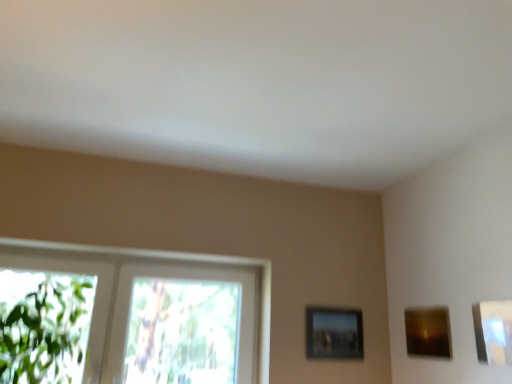
Question: Can you confirm if clear glass window at left is wider than matte brown picture frame at upper right, acting as the second picture frame starting from the left?

Choices:
 (A) yes
 (B) no

Answer: (A)

Question: Is clear glass window at left in front of matte brown picture frame at upper right, acting as the second picture frame starting from the left?

Choices:
 (A) yes
 (B) no

Answer: (B)

Question: Could you tell me if clear glass window at left is facing matte brown picture frame at upper right, which ranks as the second picture frame in back-to-front order?

Choices:
 (A) yes
 (B) no

Answer: (B)

Question: From the image's perspective, does clear glass window at left appear higher than matte brown picture frame at upper right, which appears as the 2th picture frame when viewed from the right?

Choices:
 (A) yes
 (B) no

Answer: (A)

Question: Can you confirm if clear glass window at left is smaller than matte brown picture frame at upper right, which appears as the 2th picture frame when viewed from the right?

Choices:
 (A) yes
 (B) no

Answer: (B)

Question: Considering the positions of point (507, 304) and point (215, 261), is point (507, 304) closer or farther from the camera than point (215, 261)?

Choices:
 (A) closer
 (B) farther

Answer: (A)

Question: From their relative heights in the image, would you say metallic silver picture frame at upper right, marked as the first picture frame in a front-to-back arrangement, is taller or shorter than clear glass window at left?

Choices:
 (A) short
 (B) tall

Answer: (A)

Question: From the image's perspective, is metallic silver picture frame at upper right, acting as the 3th picture frame starting from the back, located above or below clear glass window at left?

Choices:
 (A) above
 (B) below

Answer: (A)

Question: Is metallic silver picture frame at upper right, arranged as the 3th picture frame when viewed from the left, wider or thinner than clear glass window at left?

Choices:
 (A) thin
 (B) wide

Answer: (A)

Question: Is clear glass window at left situated inside metallic silver picture frame at center-right, acting as the 3th picture frame starting from the right, or outside?

Choices:
 (A) outside
 (B) inside

Answer: (A)

Question: Is point pos(184,256) positioned closer to the camera than point pos(361,344)?

Choices:
 (A) farther
 (B) closer

Answer: (B)

Question: From the image's perspective, is clear glass window at left positioned above or below metallic silver picture frame at center-right, acting as the 3th picture frame starting from the right?

Choices:
 (A) below
 (B) above

Answer: (B)

Question: Visually, is clear glass window at left positioned to the left or to the right of metallic silver picture frame at center-right, the 1th picture frame when ordered from back to front?

Choices:
 (A) right
 (B) left

Answer: (B)

Question: Looking at their shapes, would you say clear glass window at left is wider or thinner than metallic silver picture frame at upper right, which is counted as the 1th picture frame, starting from the right?

Choices:
 (A) wide
 (B) thin

Answer: (A)

Question: Considering the positions of clear glass window at left and metallic silver picture frame at upper right, marked as the first picture frame in a front-to-back arrangement, in the image, is clear glass window at left taller or shorter than metallic silver picture frame at upper right, marked as the first picture frame in a front-to-back arrangement,?

Choices:
 (A) short
 (B) tall

Answer: (B)